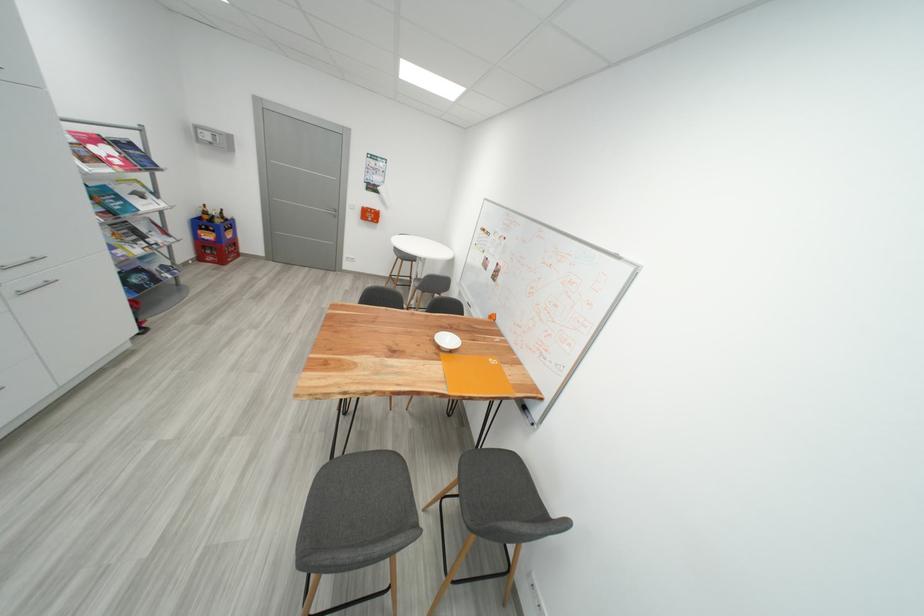
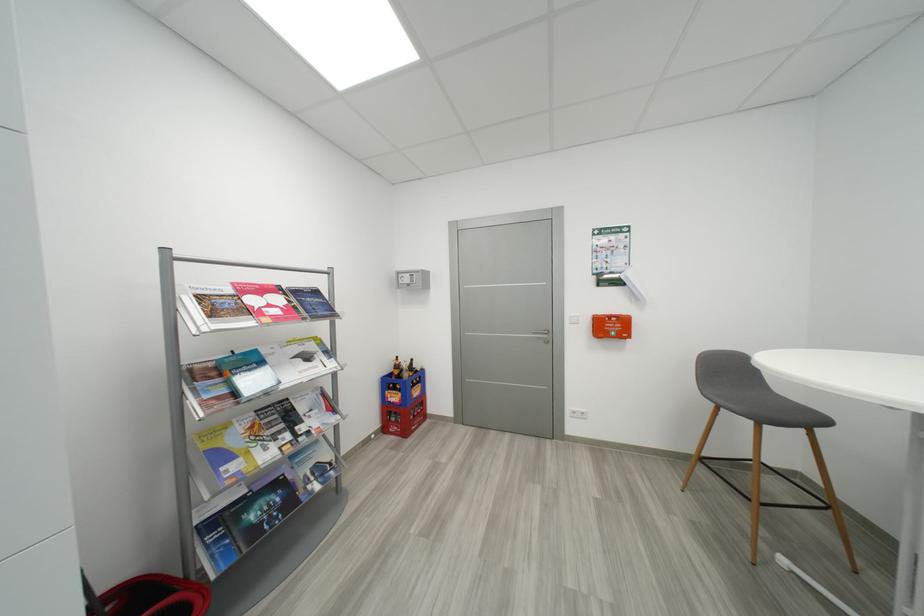
The point at (214,139) is marked in the first image. Where is the corresponding point in the second image?

(412, 282)